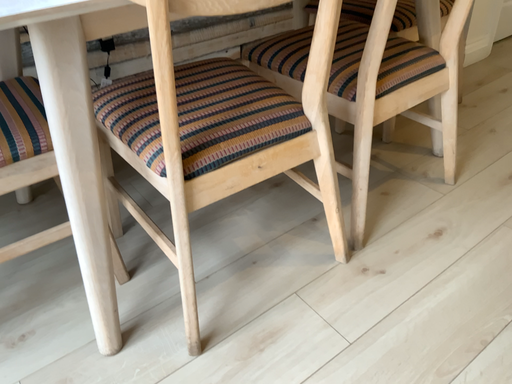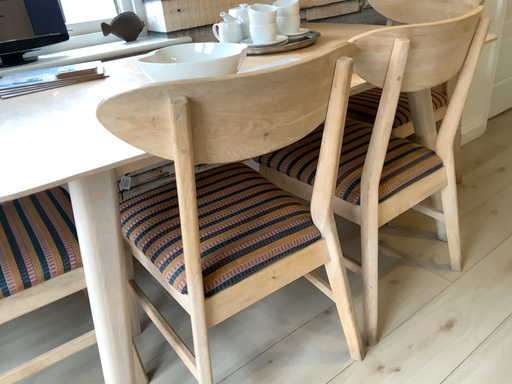
Question: Which way did the camera rotate in the video?

Choices:
 (A) rotated downward
 (B) rotated upward

Answer: (B)